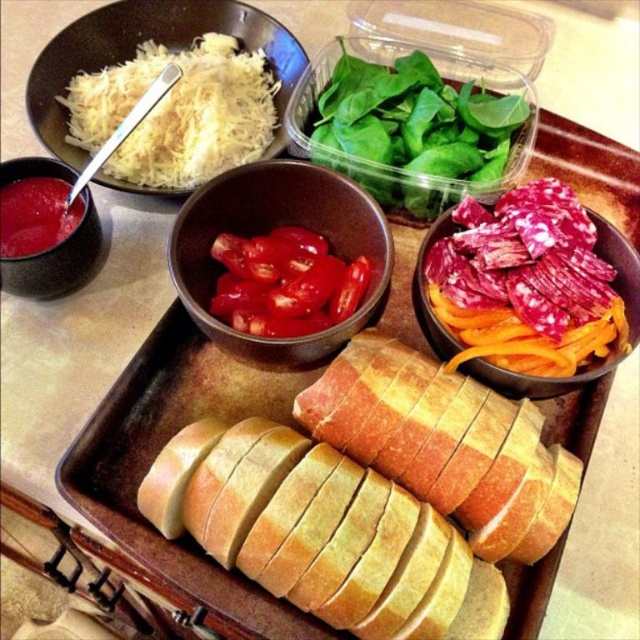
Consider the image. You are arranging food on a tray and need to place the green leafy spinach at upper center and the sliced salami at center. Which of the two items has a greater width?

The green leafy spinach at upper center has a greater width than the sliced salami at center.

You are arranging food on a tray and need to place the golden brown crusty bread at center and the matte black bowl at upper left. Based on the scene, where should you position the bread relative to the bowl?

The golden brown crusty bread at center should be placed to the right of the matte black bowl at upper left as per the scene description.